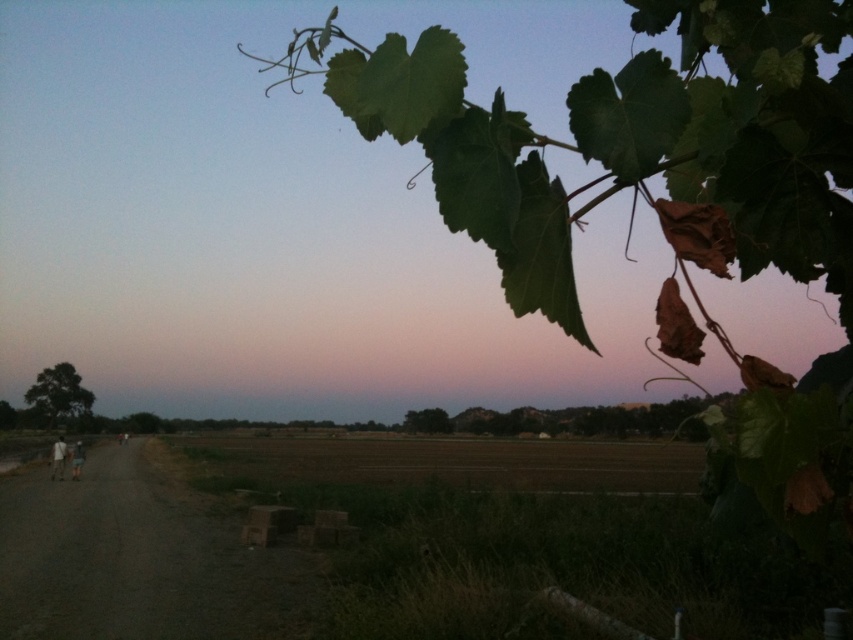
Question: Can you confirm if light brown fabric pants at left is smaller than white fabric person at lower left?

Choices:
 (A) yes
 (B) no

Answer: (B)

Question: Is brown soil at center to the left of white fabric person at lower left from the viewer's perspective?

Choices:
 (A) no
 (B) yes

Answer: (A)

Question: Is dark brown dirt track at lower left smaller than brown soil at center?

Choices:
 (A) no
 (B) yes

Answer: (B)

Question: Which point is farther to the camera?

Choices:
 (A) (283, 490)
 (B) (125, 531)

Answer: (A)

Question: Among these points, which one is farthest from the camera?

Choices:
 (A) (51, 458)
 (B) (624, 442)
 (C) (292, 620)

Answer: (B)

Question: Which object is farther from the camera taking this photo?

Choices:
 (A) brown soil at center
 (B) dark brown dirt track at lower left
 (C) white fabric person at lower left

Answer: (C)